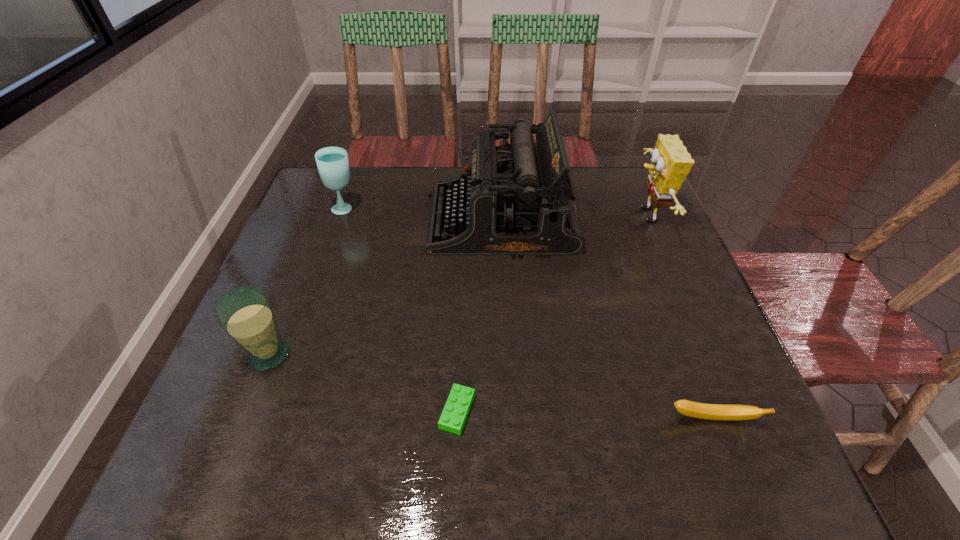
Where is `free space between the fourth farthest object and the sponge`? The height and width of the screenshot is (540, 960). free space between the fourth farthest object and the sponge is located at coordinates (457, 285).

Find the location of a particular element. The width and height of the screenshot is (960, 540). empty space between the fifth tallest object and the Lego is located at coordinates (585, 415).

Identify the location of vacant area that lies between the sponge and the nearer glass. (457, 285).

The width and height of the screenshot is (960, 540). I want to click on vacant space that is in between the fourth farthest object and the banana, so (x=491, y=387).

Find the location of a particular element. empty location between the tallest object and the farther glass is located at coordinates (422, 214).

Point out which object is positioned as the third nearest to the sponge. Please provide its 2D coordinates. Your answer should be formatted as a tuple, i.e. [(x, y)], where the tuple contains the x and y coordinates of a point satisfying the conditions above.

[(455, 412)]

Identify which object is located as the third nearest to the second tallest object. Please provide its 2D coordinates. Your answer should be formatted as a tuple, i.e. [(x, y)], where the tuple contains the x and y coordinates of a point satisfying the conditions above.

[(455, 412)]